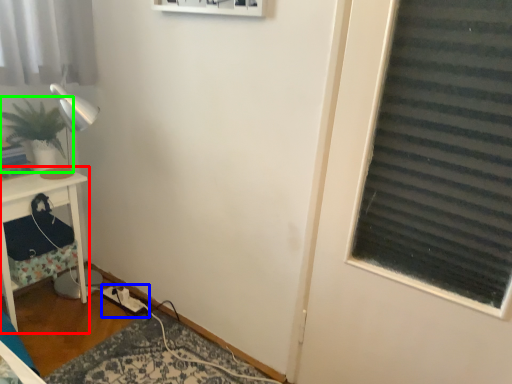
Question: Considering the real-world distances, which object is closest to furniture (highlighted by a red box)? extension cord (highlighted by a blue box) or houseplant (highlighted by a green box).

Choices:
 (A) extension cord
 (B) houseplant

Answer: (B)